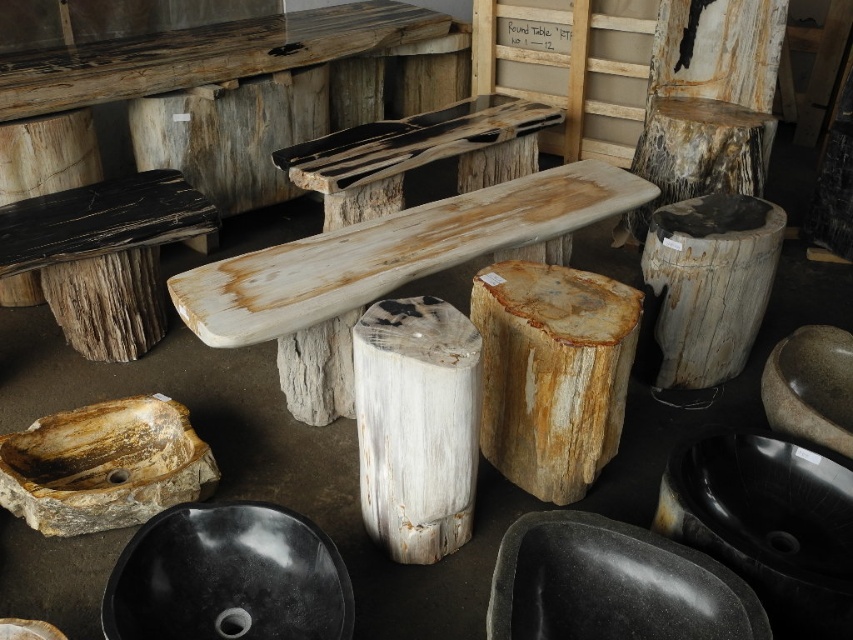
Question: Can you confirm if natural wood bench at center is smaller than speckled wood stool at center?

Choices:
 (A) yes
 (B) no

Answer: (B)

Question: Is natural wood stump at center to the left of speckled wood stool at center from the viewer's perspective?

Choices:
 (A) yes
 (B) no

Answer: (A)

Question: Does natural wood stump at center lie behind speckled wood stool at center?

Choices:
 (A) yes
 (B) no

Answer: (B)

Question: Which of the following is the closest to the observer?

Choices:
 (A) (666, 20)
 (B) (622, 172)
 (C) (686, 296)

Answer: (C)

Question: Which point appears farthest from the camera in this image?

Choices:
 (A) (689, 220)
 (B) (576, 189)

Answer: (B)

Question: Which point is closer to the camera taking this photo?

Choices:
 (A) (604, 340)
 (B) (709, 152)

Answer: (A)